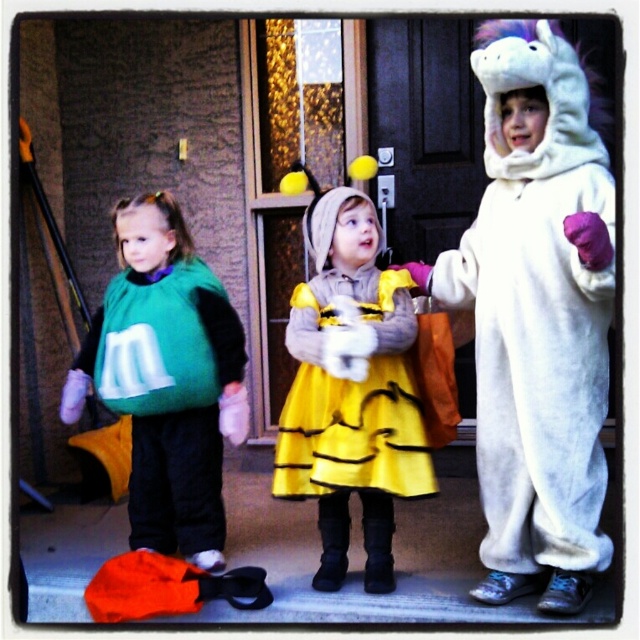
Question: Does yellow satin dress at center have a lesser width compared to green fabric m&m at left?

Choices:
 (A) yes
 (B) no

Answer: (A)

Question: Does white furry unicorn at right have a smaller size compared to yellow satin dress at center?

Choices:
 (A) yes
 (B) no

Answer: (B)

Question: Which object appears closest to the camera in this image?

Choices:
 (A) yellow satin dress at center
 (B) white furry unicorn at right

Answer: (B)

Question: Estimate the real-world distances between objects in this image. Which object is farther from the green fabric m&m at left?

Choices:
 (A) yellow satin dress at center
 (B) white furry unicorn at right

Answer: (B)

Question: Which point is closer to the camera?

Choices:
 (A) (561, 218)
 (B) (388, 301)
 (C) (150, 484)

Answer: (A)

Question: Can you confirm if white furry unicorn at right is wider than green fabric m&m at left?

Choices:
 (A) yes
 (B) no

Answer: (B)